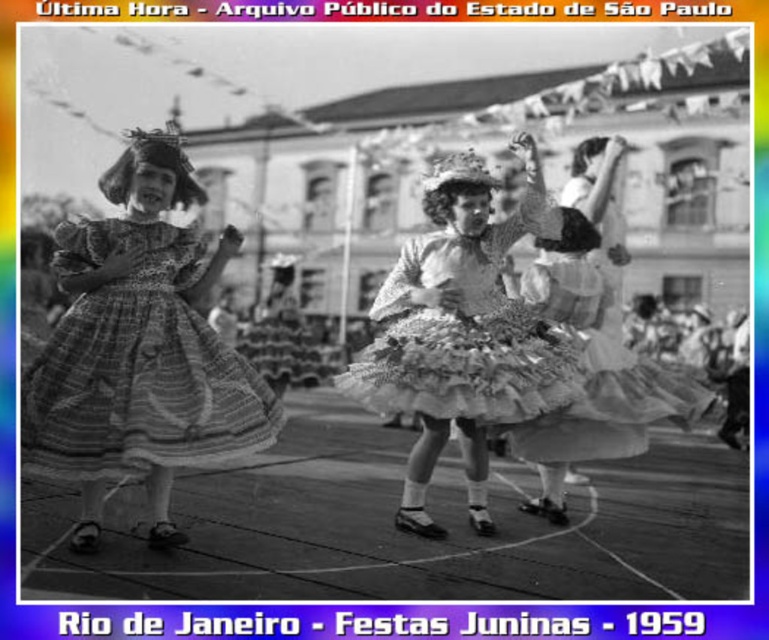
Is textured cotton dress at left shorter than white lace dress at center?

Yes.

You are a GUI agent. You are given a task and a screenshot of the screen. Output one action in this format:
    pyautogui.click(x=<x>, y=<y>)
    Task: Click on the textured cotton dress at left
    Image resolution: width=769 pixels, height=640 pixels.
    Given the screenshot: What is the action you would take?
    pyautogui.click(x=137, y=364)

In order to click on textured cotton dress at left in this screenshot , I will do `click(137, 364)`.

Does ruffled fabric dress at center appear on the left side of white lace dress at center?

Indeed, ruffled fabric dress at center is positioned on the left side of white lace dress at center.

Does point (391, 358) lie behind point (564, 250)?

No, it is not.

Where is `ruffled fabric dress at center`? This screenshot has height=640, width=769. ruffled fabric dress at center is located at coordinates (464, 332).

Does textured cotton dress at left have a greater height compared to ruffled fabric dress at center?

Indeed, textured cotton dress at left has a greater height compared to ruffled fabric dress at center.

Can you confirm if textured cotton dress at left is shorter than ruffled fabric dress at center?

No.

Between point (247, 388) and point (448, 276), which one is positioned in front?

Point (247, 388) is more forward.

Find the location of a particular element. The height and width of the screenshot is (640, 769). textured cotton dress at left is located at coordinates pos(137,364).